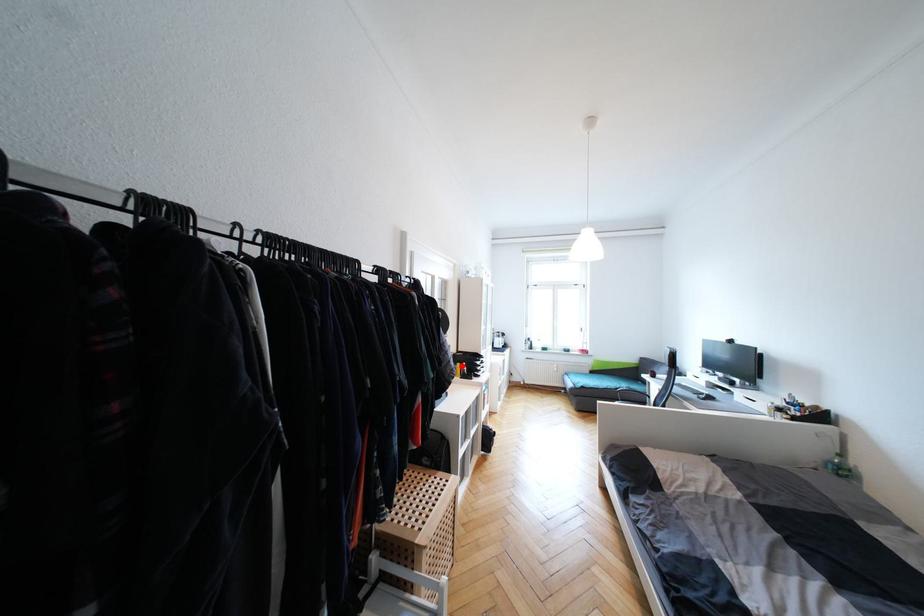
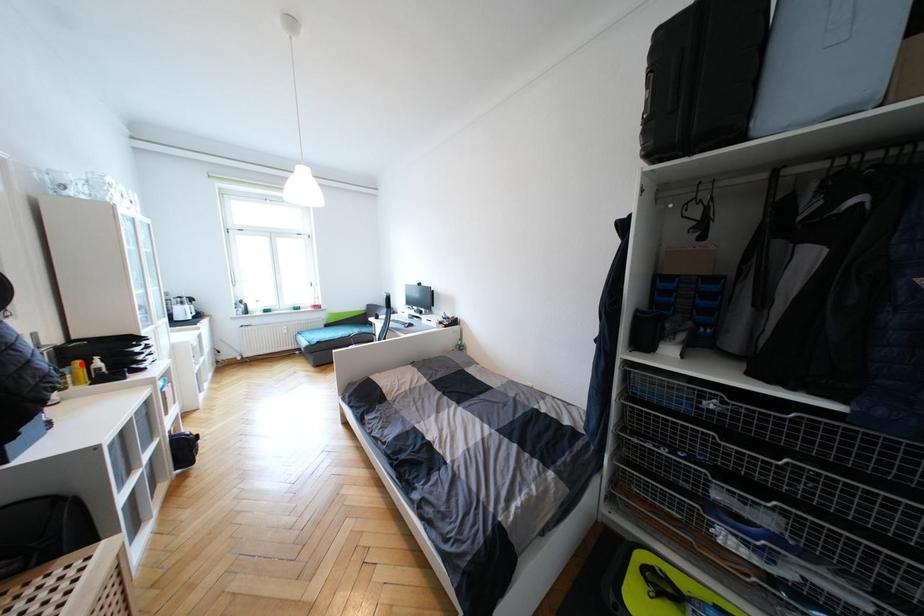
I am providing you with two images of the same scene from different viewpoints. A red point is marked on the first image and another point is marked on the second image. Is the red point in image1 aligned with the point shown in image2?

Yes